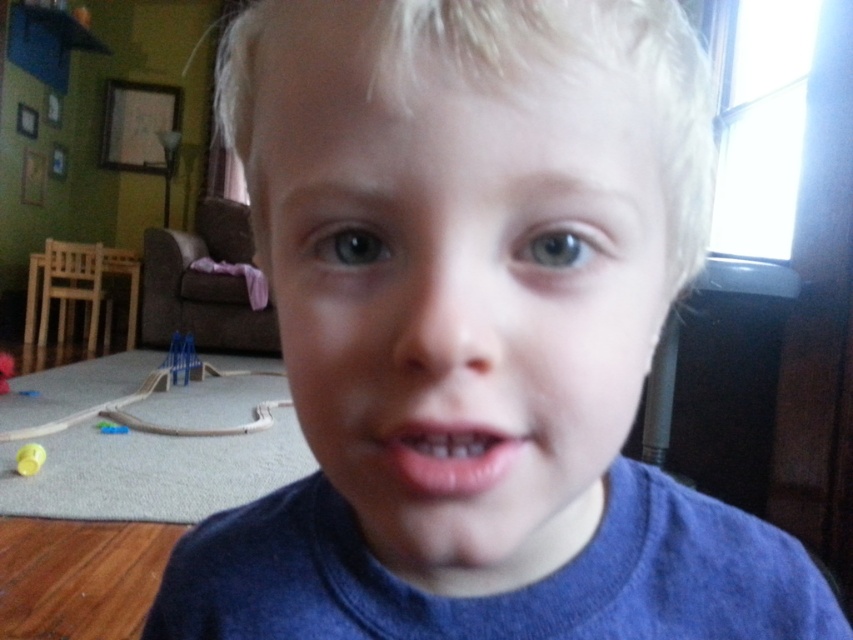
Who is shorter, smooth skin face at center or pink glossy lips at center?

pink glossy lips at center

Can you confirm if smooth skin face at center is wider than pink glossy lips at center?

Yes, smooth skin face at center is wider than pink glossy lips at center.

This screenshot has height=640, width=853. What do you see at coordinates (457, 300) in the screenshot? I see `smooth skin face at center` at bounding box center [457, 300].

You are a GUI agent. You are given a task and a screenshot of the screen. Output one action in this format:
    pyautogui.click(x=<x>, y=<y>)
    Task: Click on the smooth skin face at center
    
    Given the screenshot: What is the action you would take?
    pyautogui.click(x=457, y=300)

Does pink glossy lips at center have a greater height compared to yellow rubber ball at lower left?

No.

Does pink glossy lips at center have a larger size compared to yellow rubber ball at lower left?

Incorrect, pink glossy lips at center is not larger than yellow rubber ball at lower left.

Does point (392, 433) lie in front of point (27, 448)?

Yes, it is.

This screenshot has width=853, height=640. I want to click on pink glossy lips at center, so click(x=445, y=456).

Can you confirm if smooth skin face at center is smaller than yellow rubber ball at lower left?

No, smooth skin face at center is not smaller than yellow rubber ball at lower left.

Does point (616, 285) come in front of point (27, 460)?

Yes.

You are a GUI agent. You are given a task and a screenshot of the screen. Output one action in this format:
    pyautogui.click(x=<x>, y=<y>)
    Task: Click on the smooth skin face at center
    
    Given the screenshot: What is the action you would take?
    pyautogui.click(x=457, y=300)